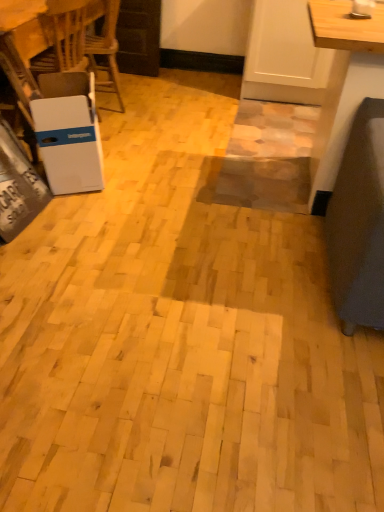
At what (x,y) coordinates should I click in order to perform the action: click on white cardboard box at left. Please return your answer as a coordinate pair (x, y). Image resolution: width=384 pixels, height=512 pixels. Looking at the image, I should click on (69, 132).

Describe the element at coordinates (69, 132) in the screenshot. I see `white cardboard box at left` at that location.

The width and height of the screenshot is (384, 512). Describe the element at coordinates (20, 70) in the screenshot. I see `white plastic table at left` at that location.

Locate an element on the screen. white plastic table at left is located at coordinates (20, 70).

Where is `white cardboard box at left`? white cardboard box at left is located at coordinates (69, 132).

Is white cardboard box at left at the left side of white plastic table at left?

Incorrect, white cardboard box at left is not on the left side of white plastic table at left.

In the image, is white cardboard box at left positioned in front of or behind white plastic table at left?

In the image, white cardboard box at left appears in front of white plastic table at left.

Is point (32, 108) closer to viewer compared to point (30, 85)?

Yes, it is in front of point (30, 85).

Looking at this image, from the image's perspective, between white cardboard box at left and white plastic table at left, who is located below?

white cardboard box at left.

From a real-world perspective, is white cardboard box at left physically located above or below white plastic table at left?

white cardboard box at left is below white plastic table at left.

Which object is wider, white cardboard box at left or white plastic table at left?

Wider between the two is white plastic table at left.

Considering the relative sizes of white cardboard box at left and white plastic table at left in the image provided, is white cardboard box at left taller than white plastic table at left?

No.

Is white cardboard box at left smaller than white plastic table at left?

Indeed, white cardboard box at left has a smaller size compared to white plastic table at left.

Is white cardboard box at left inside or outside of white plastic table at left?

white cardboard box at left lies outside white plastic table at left.

Is white cardboard box at left next to white plastic table at left?

No, white cardboard box at left is not with white plastic table at left.

Is white cardboard box at left oriented away from white plastic table at left?

white cardboard box at left is not turned away from white plastic table at left.

What's the angular difference between white cardboard box at left and white plastic table at left's facing directions?

The angular difference between white cardboard box at left and white plastic table at left is 160 degrees.

Locate an element on the screen. This screenshot has width=384, height=512. table positioned vertically above the white cardboard box at left (from a real-world perspective) is located at coordinates (20, 70).

Between white plastic table at left and white cardboard box at left, which one appears on the right side from the viewer's perspective?

white cardboard box at left is more to the right.

Considering their positions, is white plastic table at left located in front of or behind white cardboard box at left?

In the image, white plastic table at left appears behind white cardboard box at left.

Is point (8, 1) closer or farther from the camera than point (62, 190)?

Point (8, 1) appears to be closer to the viewer than point (62, 190).

From the image's perspective, is white plastic table at left above white cardboard box at left?

Correct, white plastic table at left appears higher than white cardboard box at left in the image.

From a real-world perspective, who is located higher, white plastic table at left or white cardboard box at left?

white plastic table at left.

Which of these two, white plastic table at left or white cardboard box at left, is thinner?

With smaller width is white cardboard box at left.

Considering the sizes of objects white plastic table at left and white cardboard box at left in the image provided, who is taller, white plastic table at left or white cardboard box at left?

white plastic table at left.

Considering the sizes of objects white plastic table at left and white cardboard box at left in the image provided, who is smaller, white plastic table at left or white cardboard box at left?

Smaller between the two is white cardboard box at left.

Would you say white cardboard box at left is part of white plastic table at left's contents?

No, white cardboard box at left is not a part of white plastic table at left.

Is white plastic table at left not near white cardboard box at left?

white plastic table at left is actually quite close to white cardboard box at left.

Could you tell me if white plastic table at left is turned towards white cardboard box at left?

No.

Image resolution: width=384 pixels, height=512 pixels. Identify the location of table lying on the left of white cardboard box at left. coord(20,70).

Where is `table that appears on the left of white cardboard box at left`? This screenshot has width=384, height=512. table that appears on the left of white cardboard box at left is located at coordinates (20, 70).

The height and width of the screenshot is (512, 384). Find the location of `cardboard box below the white plastic table at left (from a real-world perspective)`. cardboard box below the white plastic table at left (from a real-world perspective) is located at coordinates (69, 132).